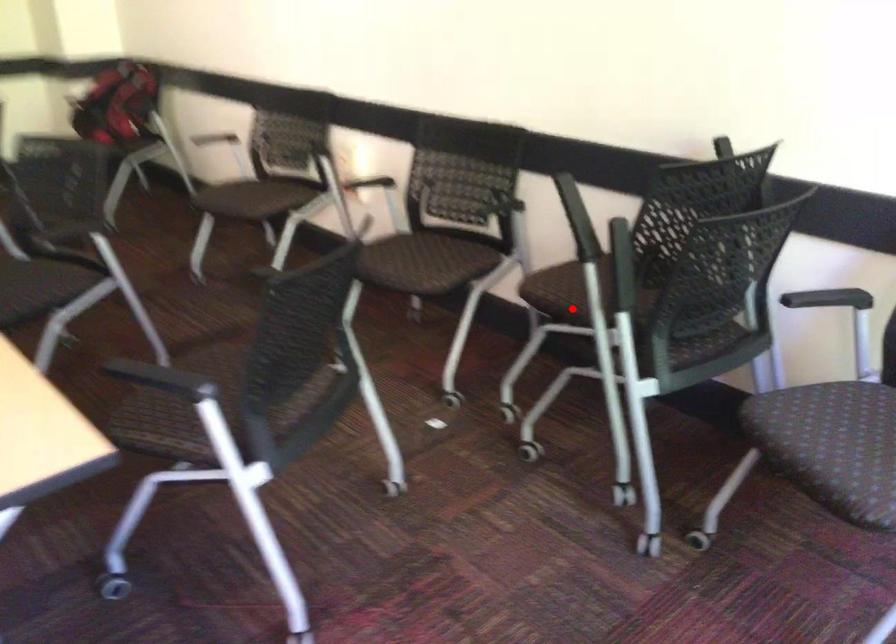
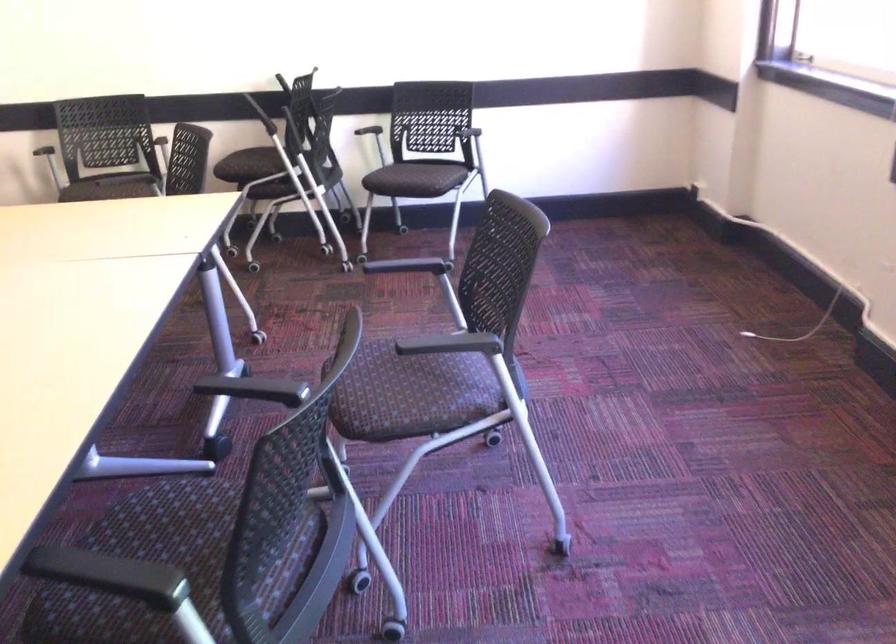
Question: I am providing you with two images of the same scene from different viewpoints. Given a red point in image1, look at the same physical point in image2. Is it:

Choices:
 (A) Closer to the viewpoint
 (B) Farther from the viewpoint

Answer: (B)